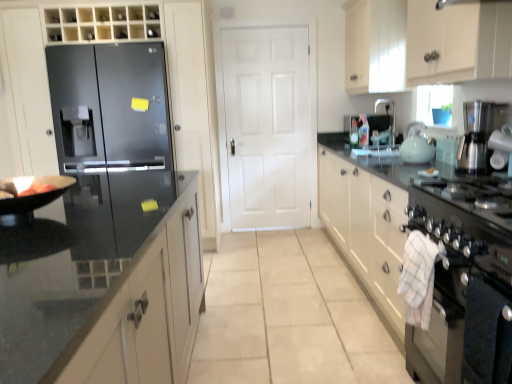
Where is `free space above white matte door at center (from a real-world perspective)`? free space above white matte door at center (from a real-world perspective) is located at coordinates (265, 31).